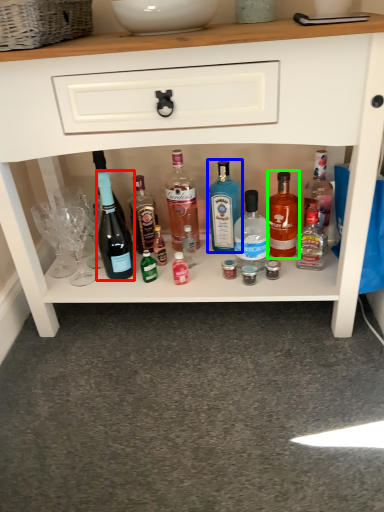
Question: Which is farther away from bottle (highlighted by a red box)? bottle (highlighted by a blue box) or bottle (highlighted by a green box)?

Choices:
 (A) bottle
 (B) bottle

Answer: (B)